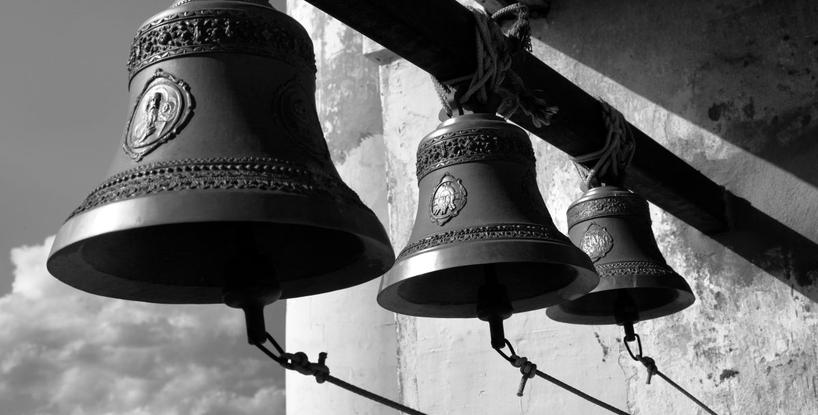
I want to click on bar, so click(x=744, y=225).